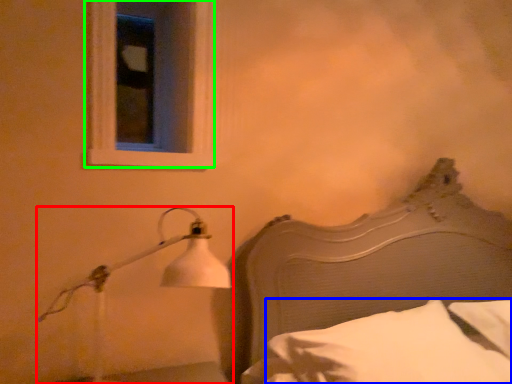
Question: Estimate the real-world distances between objects in this image. Which object is farther from lamp (highlighted by a red box), pillow (highlighted by a blue box) or window (highlighted by a green box)?

Choices:
 (A) pillow
 (B) window

Answer: (A)